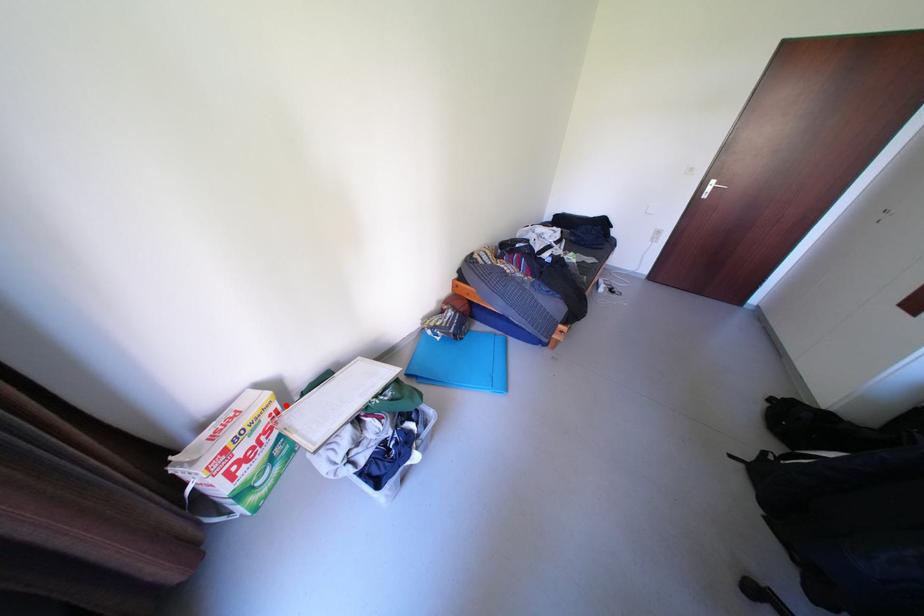
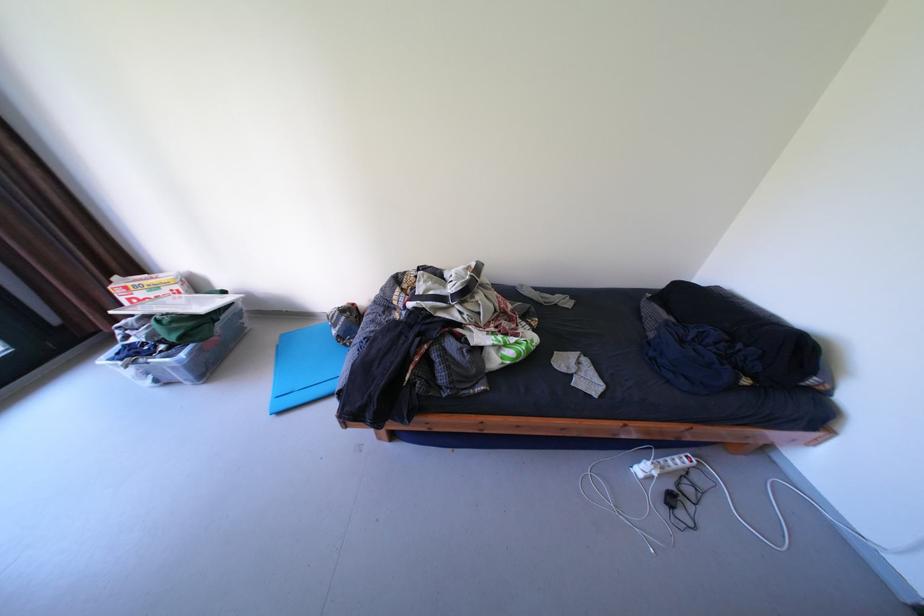
Locate, in the second image, the point that corresponds to the highlighted location in the first image.

(188, 286)